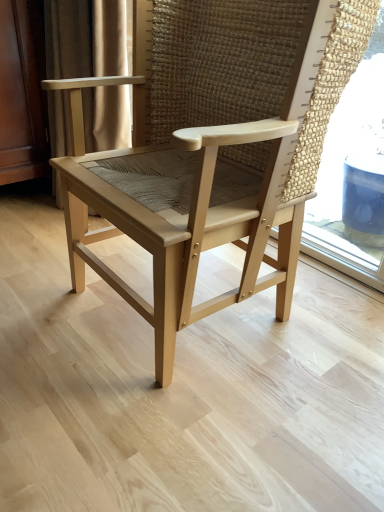
You are a GUI agent. You are given a task and a screenshot of the screen. Output one action in this format:
    pyautogui.click(x=<x>, y=<y>)
    Task: Click on the natural wood chair at center
    The height and width of the screenshot is (512, 384).
    Given the screenshot: What is the action you would take?
    pyautogui.click(x=212, y=145)

What is the approximate width of natural wood chair at center?

natural wood chair at center is 23.06 inches wide.

This screenshot has width=384, height=512. What do you see at coordinates (212, 145) in the screenshot? I see `natural wood chair at center` at bounding box center [212, 145].

What do you see at coordinates (85, 38) in the screenshot?
I see `satin gold curtain at left` at bounding box center [85, 38].

The image size is (384, 512). Find the location of `satin gold curtain at left`. satin gold curtain at left is located at coordinates (85, 38).

I want to click on natural wood chair at center, so click(x=212, y=145).

Is natural wood chair at center at the left side of satin gold curtain at left?

No, natural wood chair at center is not to the left of satin gold curtain at left.

Considering the positions of objects natural wood chair at center and satin gold curtain at left in the image provided, who is behind, natural wood chair at center or satin gold curtain at left?

satin gold curtain at left is further from the camera.

From the picture: Which is farther, (x=311, y=66) or (x=123, y=119)?

The point (x=123, y=119) is behind.

From the image's perspective, which is below, natural wood chair at center or satin gold curtain at left?

From the image's view, natural wood chair at center is below.

From the picture: From a real-world perspective, is natural wood chair at center over satin gold curtain at left?

Yes.

From the picture: Is natural wood chair at center thinner than satin gold curtain at left?

No, natural wood chair at center is not thinner than satin gold curtain at left.

Considering the sizes of objects natural wood chair at center and satin gold curtain at left in the image provided, who is shorter, natural wood chair at center or satin gold curtain at left?

natural wood chair at center is shorter.

Looking at the image, does natural wood chair at center seem bigger or smaller compared to satin gold curtain at left?

Considering their sizes, natural wood chair at center takes up more space than satin gold curtain at left.

Is natural wood chair at center outside of satin gold curtain at left?

Absolutely, natural wood chair at center is external to satin gold curtain at left.

Is natural wood chair at center directly adjacent to satin gold curtain at left?

No, natural wood chair at center is not beside satin gold curtain at left.

Does natural wood chair at center turn towards satin gold curtain at left?

No, natural wood chair at center is not aimed at satin gold curtain at left.

Locate an element on the screen. The width and height of the screenshot is (384, 512). chair on the right of satin gold curtain at left is located at coordinates (212, 145).

Considering the positions of objects satin gold curtain at left and natural wood chair at center in the image provided, who is more to the left, satin gold curtain at left or natural wood chair at center?

satin gold curtain at left is more to the left.

Is satin gold curtain at left behind natural wood chair at center?

Yes, satin gold curtain at left is behind natural wood chair at center.

Does point (61, 155) come farther from viewer compared to point (312, 46)?

Yes, it is behind point (312, 46).

Consider the image. From the image's perspective, is satin gold curtain at left located above natural wood chair at center?

Yes, from the image's perspective, satin gold curtain at left is over natural wood chair at center.

From a real-world perspective, is satin gold curtain at left positioned above or below natural wood chair at center?

satin gold curtain at left is situated lower than natural wood chair at center in the real world.

Considering the sizes of objects satin gold curtain at left and natural wood chair at center in the image provided, who is wider, satin gold curtain at left or natural wood chair at center?

With larger width is natural wood chair at center.

Looking at this image, between satin gold curtain at left and natural wood chair at center, which one has more height?

With more height is satin gold curtain at left.

Can you confirm if satin gold curtain at left is smaller than natural wood chair at center?

Yes, satin gold curtain at left is smaller than natural wood chair at center.

Which is correct: satin gold curtain at left is inside natural wood chair at center, or outside of it?

satin gold curtain at left is not enclosed by natural wood chair at center.

Would you say satin gold curtain at left is a long distance from natural wood chair at center?

satin gold curtain at left is actually quite close to natural wood chair at center.

In the scene shown: Is satin gold curtain at left oriented towards natural wood chair at center?

No, satin gold curtain at left is not facing towards natural wood chair at center.

How distant is satin gold curtain at left from natural wood chair at center?

satin gold curtain at left and natural wood chair at center are 38.24 centimeters apart from each other.

I want to click on curtain behind the natural wood chair at center, so click(85, 38).

I want to click on chair below the satin gold curtain at left (from the image's perspective), so click(x=212, y=145).

You are a GUI agent. You are given a task and a screenshot of the screen. Output one action in this format:
    pyautogui.click(x=<x>, y=<y>)
    Task: Click on the curtain located behind the natural wood chair at center
    Image resolution: width=384 pixels, height=512 pixels.
    Given the screenshot: What is the action you would take?
    point(85,38)